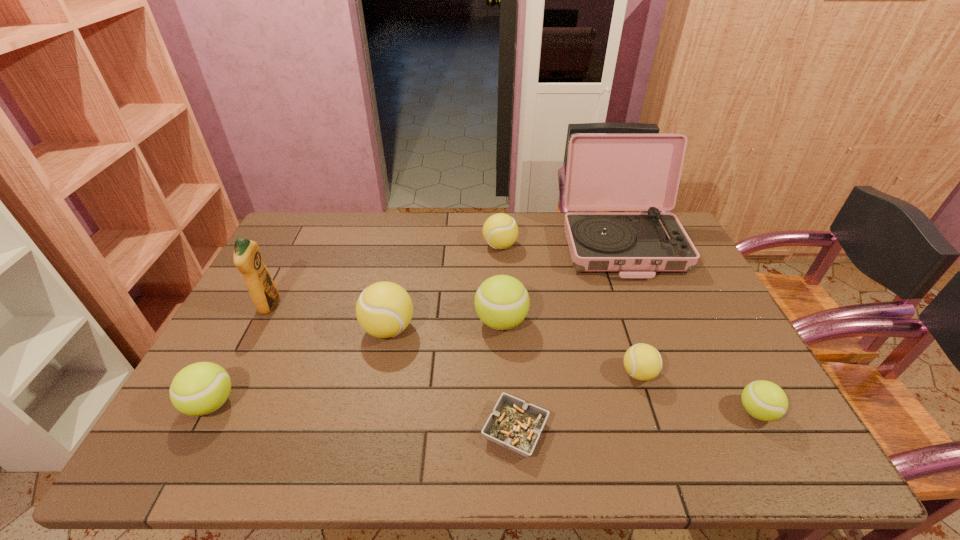
Choose which object is the fourth nearest neighbor to the tallest object. Please provide its 2D coordinates. Your answer should be formatted as a tuple, i.e. [(x, y)], where the tuple contains the x and y coordinates of a point satisfying the conditions above.

[(764, 400)]

Select which object is the closest to the rightmost green tennis ball. Please provide its 2D coordinates. Your answer should be formatted as a tuple, i.e. [(x, y)], where the tuple contains the x and y coordinates of a point satisfying the conditions above.

[(643, 362)]

Find the location of `tennis ball that stands as the fifth closest to the smallest yellow tennis ball`. tennis ball that stands as the fifth closest to the smallest yellow tennis ball is located at coordinates (201, 388).

Locate which tennis ball is the second closest to the shortest object. Please provide its 2D coordinates. Your answer should be formatted as a tuple, i.e. [(x, y)], where the tuple contains the x and y coordinates of a point satisfying the conditions above.

[(643, 362)]

Identify which yellow tennis ball is the closest to the record player. Please provide its 2D coordinates. Your answer should be formatted as a tuple, i.e. [(x, y)], where the tuple contains the x and y coordinates of a point satisfying the conditions above.

[(500, 231)]

Locate an element on the screen. This screenshot has width=960, height=540. yellow tennis ball that is the third closest one to the biggest green tennis ball is located at coordinates (643, 362).

The width and height of the screenshot is (960, 540). Find the location of `green tennis ball that is the second closest to the rightmost green tennis ball`. green tennis ball that is the second closest to the rightmost green tennis ball is located at coordinates (201, 388).

Locate an element on the screen. Image resolution: width=960 pixels, height=540 pixels. the third closest green tennis ball to the farthest yellow tennis ball is located at coordinates (201, 388).

You are a GUI agent. You are given a task and a screenshot of the screen. Output one action in this format:
    pyautogui.click(x=<x>, y=<y>)
    Task: Click on the free space that satisfies the following two spatial constraints: 1. on the label of the second green tennis ball from right to left; 2. on the left side of the eighth shortest object
    
    Given the screenshot: What is the action you would take?
    pyautogui.click(x=261, y=321)

The image size is (960, 540). What are the coordinates of `vacant space that satisfies the following two spatial constraints: 1. with the lid open on the smallest green tennis ball; 2. on the right side of the record player` in the screenshot? It's located at (688, 411).